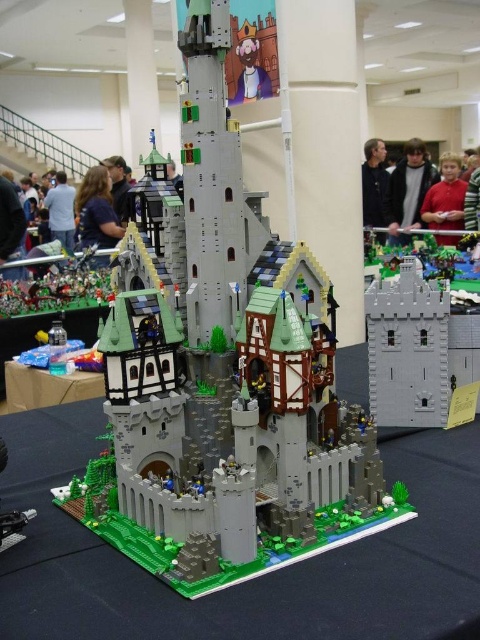
Question: Which point is farther to the camera?

Choices:
 (A) (98, 221)
 (B) (386, 216)
 (C) (124, 221)

Answer: (B)

Question: Which of the following is the farthest from the observer?

Choices:
 (A) (54, 227)
 (B) (415, 317)

Answer: (A)

Question: Which of the following is the farthest from the observer?

Choices:
 (A) light brown leather jacket at upper center
 (B) blue shirt at center

Answer: (A)

Question: Can you confirm if matte red shirt at center is positioned to the right of blue shirt at center?

Choices:
 (A) no
 (B) yes

Answer: (B)

Question: Is the position of matte red shirt at center less distant than that of black matte jacket at upper center?

Choices:
 (A) no
 (B) yes

Answer: (B)

Question: Can you confirm if light brown leather jacket at upper center is smaller than matte black hair at upper left?

Choices:
 (A) yes
 (B) no

Answer: (B)